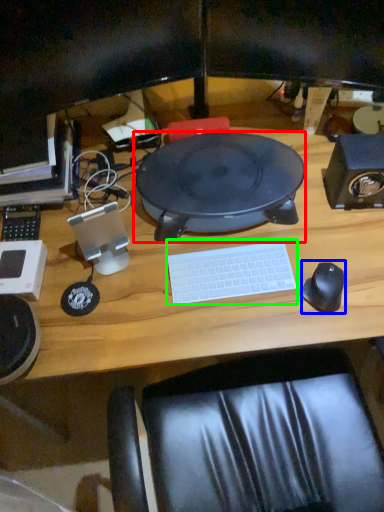
Question: Which is nearer to the sit (highlighted by a red box)? mouse (highlighted by a blue box) or computer keyboard (highlighted by a green box).

Choices:
 (A) mouse
 (B) computer keyboard

Answer: (B)